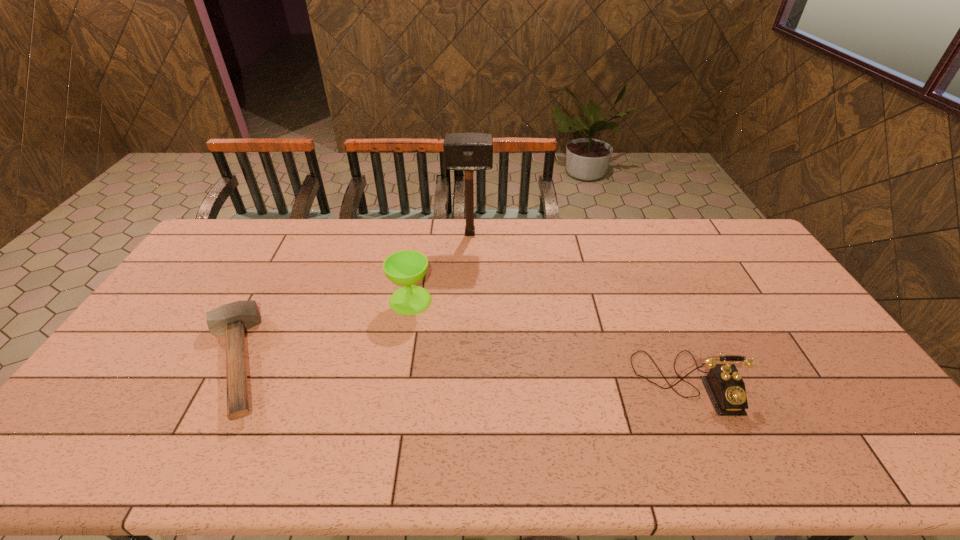
I want to click on blank region between the right mallet and the shorter mallet, so click(x=352, y=298).

I want to click on free area in between the rightmost object and the left mallet, so click(461, 372).

Locate an element on the screen. Image resolution: width=960 pixels, height=540 pixels. free area in between the shortest object and the farther mallet is located at coordinates (352, 298).

Find the location of a particular element. This screenshot has width=960, height=540. free space between the leftmost object and the farther mallet is located at coordinates (352, 298).

At what (x,y) coordinates should I click in order to perform the action: click on empty space that is in between the farthest object and the third shortest object. Please return your answer as a coordinate pair (x, y). The height and width of the screenshot is (540, 960). Looking at the image, I should click on 441,267.

At what (x,y) coordinates should I click in order to perform the action: click on free point between the nearer mallet and the taller mallet. Please return your answer as a coordinate pair (x, y). Looking at the image, I should click on (352, 298).

The height and width of the screenshot is (540, 960). Identify the location of vacant space in between the third object from right to left and the left mallet. (323, 331).

Locate an element on the screen. The width and height of the screenshot is (960, 540). free area in between the shortest object and the taller mallet is located at coordinates (352, 298).

At what (x,y) coordinates should I click in order to perform the action: click on free point between the telephone and the left mallet. Please return your answer as a coordinate pair (x, y). This screenshot has width=960, height=540. Looking at the image, I should click on (461, 372).

Identify the location of object that ranks as the second closest to the left mallet. (468, 152).